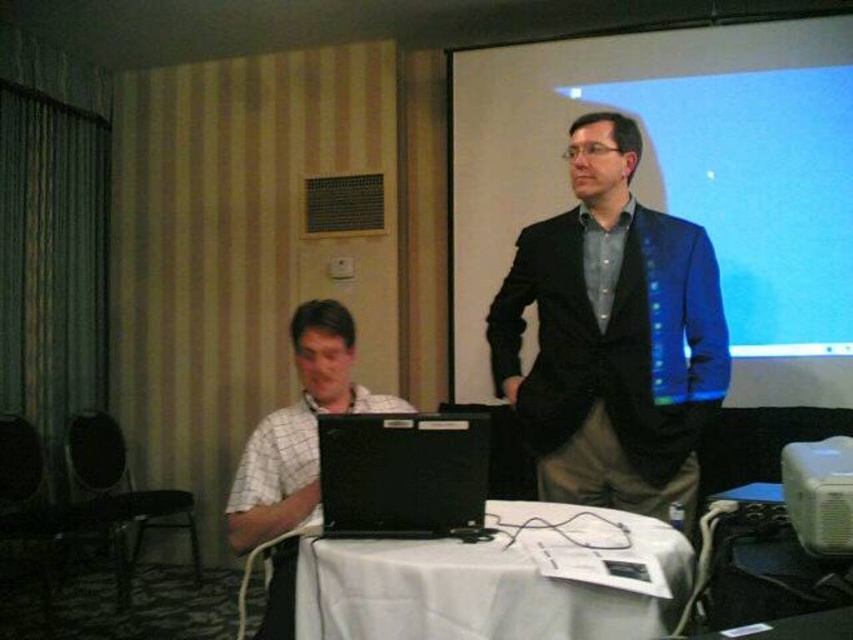
Is white cloth-covered table at center wider than white plastic projector at lower right?

Indeed, white cloth-covered table at center has a greater width compared to white plastic projector at lower right.

Can you confirm if white cloth-covered table at center is positioned above white plastic projector at lower right?

Incorrect, white cloth-covered table at center is not positioned above white plastic projector at lower right.

This screenshot has width=853, height=640. Describe the element at coordinates (498, 579) in the screenshot. I see `white cloth-covered table at center` at that location.

I want to click on white cloth-covered table at center, so click(498, 579).

Which is in front, point (553, 289) or point (321, 468)?

Point (321, 468) is more forward.

Who is more distant from viewer, (567,476) or (422,449)?

Positioned behind is point (567,476).

Locate an element on the screen. matte black blazer at center is located at coordinates (612, 337).

Can you confirm if white cloth-covered table at center is positioned to the right of black matte laptop at center?

Correct, you'll find white cloth-covered table at center to the right of black matte laptop at center.

Can you confirm if white cloth-covered table at center is shorter than black matte laptop at center?

Indeed, white cloth-covered table at center has a lesser height compared to black matte laptop at center.

Does point (326, 618) lie in front of point (422, 413)?

Yes, point (326, 618) is in front of point (422, 413).

This screenshot has height=640, width=853. In order to click on white cloth-covered table at center in this screenshot , I will do `click(498, 579)`.